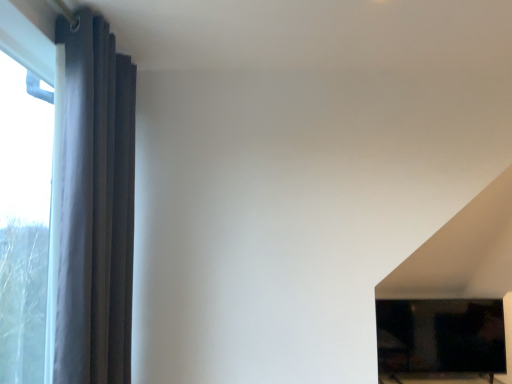
Question: Should I look upward or downward to see matte black curtain at left?

Choices:
 (A) up
 (B) down

Answer: (B)